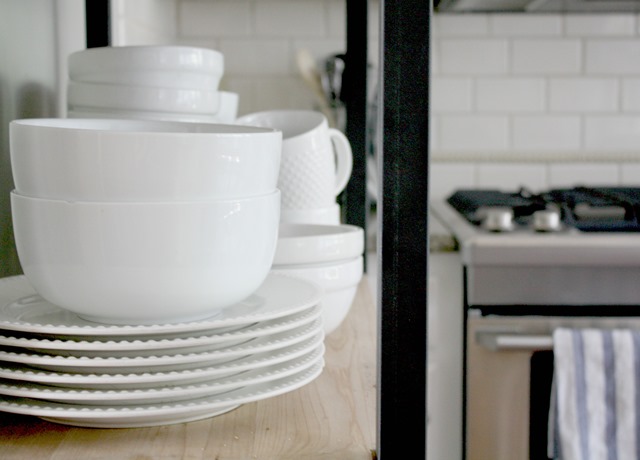
Image resolution: width=640 pixels, height=460 pixels. Find the location of `soup bowl`. soup bowl is located at coordinates (171, 171), (162, 240), (170, 98), (225, 104), (316, 255), (330, 283).